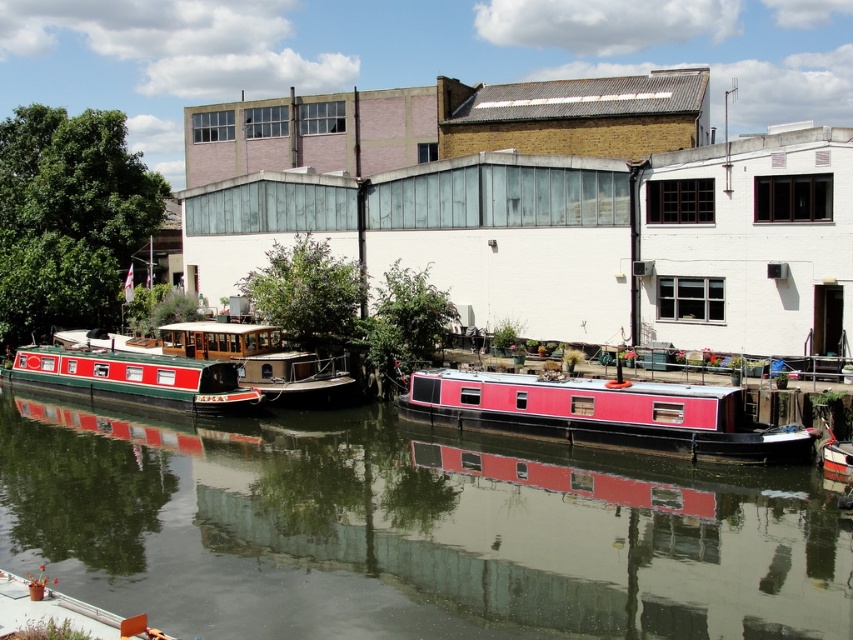
Who is shorter, matte red barge at center or red polished wood barge at center?

matte red barge at center

Is point (453, 397) farther from viewer compared to point (144, 339)?

No, it is in front of (144, 339).

Which is in front, point (637, 401) or point (347, 384)?

Point (637, 401) is in front.

This screenshot has height=640, width=853. In order to click on matte red barge at center in this screenshot , I will do `click(604, 413)`.

Locate an element on the screen. This screenshot has width=853, height=640. matte red barge at center is located at coordinates click(x=604, y=413).

Which is below, matte red barge at center or red glossy barge at left?

matte red barge at center is lower down.

The image size is (853, 640). In order to click on matte red barge at center in this screenshot , I will do `click(604, 413)`.

Can you confirm if smooth water at center is smaller than red glossy barge at left?

No.

Is point (303, 531) more distant than point (44, 381)?

That is False.

Locate an element on the screen. This screenshot has width=853, height=640. smooth water at center is located at coordinates (409, 531).